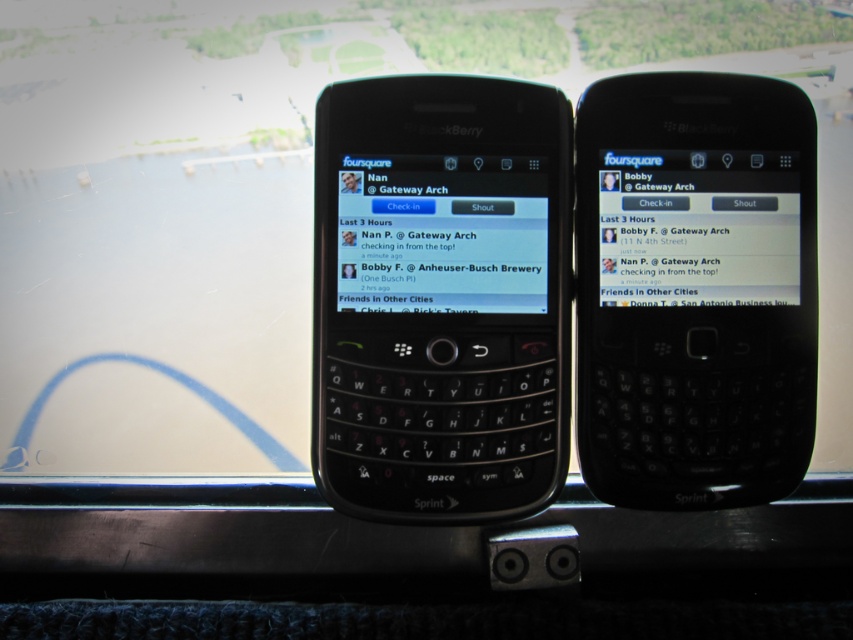
Between matte black screen at center and matte black phone at center, which one has more height?

Standing taller between the two is matte black screen at center.

Does matte black screen at center have a greater height compared to matte black phone at center?

Yes, matte black screen at center is taller than matte black phone at center.

Does point (540, 200) come in front of point (350, 182)?

That is False.

Where is `matte black screen at center`? matte black screen at center is located at coordinates (442, 236).

Which is below, matte black screen at center or black glossy screen at upper center?

matte black screen at center

Which is in front, point (469, 168) or point (767, 184)?

Point (767, 184)

Does point (526, 161) lie in front of point (705, 218)?

No, (526, 161) is further to viewer.

Where is `matte black screen at center`? matte black screen at center is located at coordinates (442, 236).

Between black matte keyboard at center and matte black screen at center, which one is positioned lower?

black matte keyboard at center is below.

Locate an element on the screen. Image resolution: width=853 pixels, height=640 pixels. black matte keyboard at center is located at coordinates (440, 298).

Find the location of a particular element. This screenshot has height=640, width=853. black matte keyboard at center is located at coordinates (440, 298).